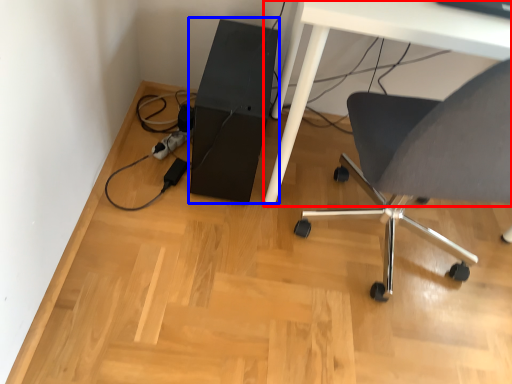
Question: Which object is further to the camera taking this photo, table (highlighted by a red box) or computer tower (highlighted by a blue box)?

Choices:
 (A) table
 (B) computer tower

Answer: (B)